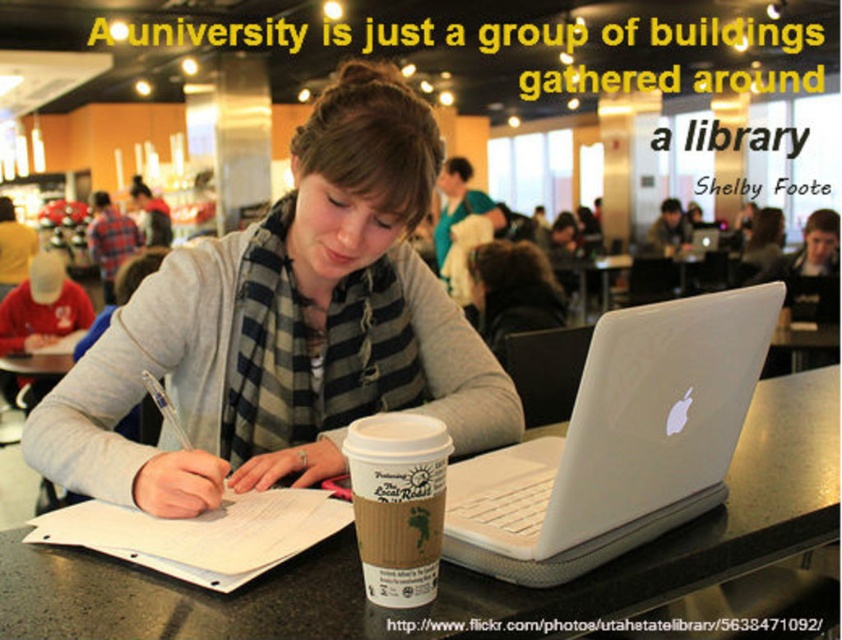
You are a student who just arrived at the library and need to place your brown paper cup at center on the table. However, there is already a white plastic laptop at center in the way. Can you move the laptop to make space for your cup?

The white plastic laptop at center is positioned over brown paper cup at center, meaning the laptop is covering the cup. To place your cup, you would need to move the laptop first.

You are a student who needs to write a note on the white paper at center. However, there is a plaid scarf at center in the way. Can you write on the paper without moving the scarf?

The white paper at center is below the plaid scarf at center, so you cannot write on the paper without moving the scarf.